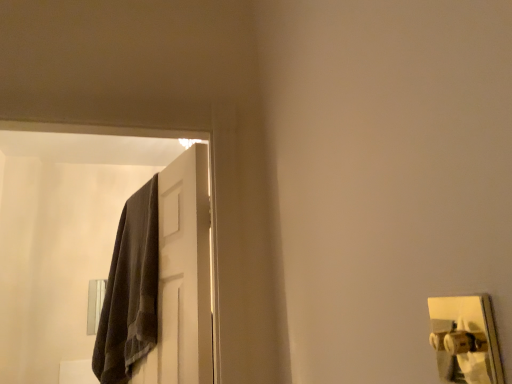
Question: Is point [195, 314] closer or farther from the camera than point [435, 309]?

Choices:
 (A) closer
 (B) farther

Answer: (A)

Question: Is white matte door at upper left taller or shorter than metallic gold door handle at upper right?

Choices:
 (A) short
 (B) tall

Answer: (B)

Question: Choose the correct answer: Is white matte door at upper left inside metallic gold door handle at upper right or outside it?

Choices:
 (A) inside
 (B) outside

Answer: (B)

Question: From the image's perspective, is metallic gold door handle at upper right positioned above or below white matte door at upper left?

Choices:
 (A) below
 (B) above

Answer: (B)

Question: Considering the positions of point (485, 317) and point (169, 360), is point (485, 317) closer or farther from the camera than point (169, 360)?

Choices:
 (A) closer
 (B) farther

Answer: (A)

Question: Is metallic gold door handle at upper right spatially inside white matte door at upper left, or outside of it?

Choices:
 (A) inside
 (B) outside

Answer: (B)

Question: In the image, is metallic gold door handle at upper right on the left side or the right side of white matte door at upper left?

Choices:
 (A) left
 (B) right

Answer: (B)